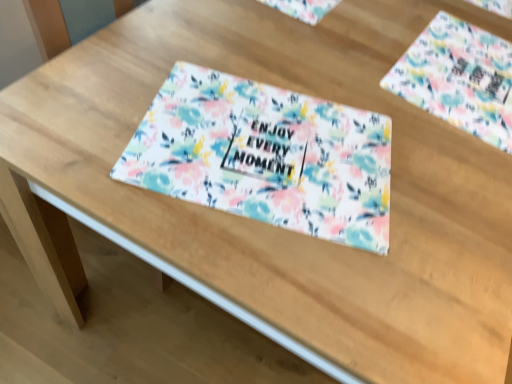
This screenshot has width=512, height=384. Find the location of `floral fabric placemat at center`. floral fabric placemat at center is located at coordinates (265, 156).

Measure the distance between point [251,161] and camera.

The distance of point [251,161] from camera is 28.74 inches.

What do you see at coordinates (265, 156) in the screenshot?
I see `floral fabric placemat at center` at bounding box center [265, 156].

Find the location of a particular element. floral fabric placemat at upper right is located at coordinates (459, 78).

This screenshot has width=512, height=384. What do you see at coordinates (459, 78) in the screenshot?
I see `floral fabric placemat at upper right` at bounding box center [459, 78].

You are a GUI agent. You are given a task and a screenshot of the screen. Output one action in this format:
    pyautogui.click(x=<x>, y=<y>)
    Task: Click on the floral fabric placemat at center
    
    Given the screenshot: What is the action you would take?
    pyautogui.click(x=265, y=156)

Does floral fabric placemat at center appear on the right side of floral fabric placemat at upper right?

In fact, floral fabric placemat at center is to the left of floral fabric placemat at upper right.

Is the depth of floral fabric placemat at center less than that of floral fabric placemat at upper right?

Yes, the depth of floral fabric placemat at center is less than that of floral fabric placemat at upper right.

Does point (359, 230) come farther from viewer compared to point (446, 25)?

That is False.

From the image's perspective, which is below, floral fabric placemat at center or floral fabric placemat at upper right?

From the image's view, floral fabric placemat at center is below.

From a real-world perspective, is floral fabric placemat at center located beneath floral fabric placemat at upper right?

No.

In terms of width, does floral fabric placemat at center look wider or thinner when compared to floral fabric placemat at upper right?

Clearly, floral fabric placemat at center has less width compared to floral fabric placemat at upper right.

Between floral fabric placemat at center and floral fabric placemat at upper right, which one has more height?

Standing taller between the two is floral fabric placemat at upper right.

Who is smaller, floral fabric placemat at center or floral fabric placemat at upper right?

With smaller size is floral fabric placemat at center.

Is floral fabric placemat at center positioned beyond the bounds of floral fabric placemat at upper right?

Yes, floral fabric placemat at center is not within floral fabric placemat at upper right.

Can you see floral fabric placemat at center touching floral fabric placemat at upper right?

No, floral fabric placemat at center is not beside floral fabric placemat at upper right.

Is floral fabric placemat at center aimed at floral fabric placemat at upper right?

No, floral fabric placemat at center is not aimed at floral fabric placemat at upper right.

How different are the orientations of floral fabric placemat at center and floral fabric placemat at upper right in degrees?

floral fabric placemat at center and floral fabric placemat at upper right are facing 68.6 degrees away from each other.

How distant is floral fabric placemat at center from floral fabric placemat at upper right?

floral fabric placemat at center and floral fabric placemat at upper right are 13.82 inches apart.

The image size is (512, 384). What are the coordinates of `tablecloth located below the floral fabric placemat at upper right (from the image's perspective)` in the screenshot? It's located at (265, 156).

Considering the positions of objects floral fabric placemat at upper right and floral fabric placemat at center in the image provided, who is more to the right, floral fabric placemat at upper right or floral fabric placemat at center?

From the viewer's perspective, floral fabric placemat at upper right appears more on the right side.

Is floral fabric placemat at upper right positioned behind floral fabric placemat at center?

Yes, floral fabric placemat at upper right is further from the camera.

Is point (485, 59) farther from viewer compared to point (182, 169)?

Yes, it is behind point (182, 169).

From the image's perspective, is floral fabric placemat at upper right above or below floral fabric placemat at center?

floral fabric placemat at upper right is above floral fabric placemat at center.

From a real-world perspective, which object rests below the other?

floral fabric placemat at upper right is physically lower.

Considering the relative sizes of floral fabric placemat at upper right and floral fabric placemat at center in the image provided, is floral fabric placemat at upper right thinner than floral fabric placemat at center?

No.

Who is taller, floral fabric placemat at upper right or floral fabric placemat at center?

floral fabric placemat at upper right is taller.

Considering the relative sizes of floral fabric placemat at upper right and floral fabric placemat at center in the image provided, is floral fabric placemat at upper right bigger than floral fabric placemat at center?

Yes, floral fabric placemat at upper right is bigger than floral fabric placemat at center.

Would you say floral fabric placemat at upper right is outside floral fabric placemat at center?

floral fabric placemat at upper right lies outside floral fabric placemat at center's area.

Is floral fabric placemat at upper right next to floral fabric placemat at center and touching it?

There is a gap between floral fabric placemat at upper right and floral fabric placemat at center.

Is floral fabric placemat at upper right positioned with its back to floral fabric placemat at center?

Yes, floral fabric placemat at upper right is facing away from floral fabric placemat at center.

Can you tell me how much floral fabric placemat at upper right and floral fabric placemat at center differ in facing direction?

The angular difference between floral fabric placemat at upper right and floral fabric placemat at center is 68.6 degrees.

Where is `flyer behind the floral fabric placemat at center`? The image size is (512, 384). flyer behind the floral fabric placemat at center is located at coordinates (459, 78).

At what (x,y) coordinates should I click in order to perform the action: click on tablecloth that is above the floral fabric placemat at upper right (from a real-world perspective). Please return your answer as a coordinate pair (x, y). Looking at the image, I should click on (265, 156).

This screenshot has height=384, width=512. What are the coordinates of `flyer behind the floral fabric placemat at center` in the screenshot? It's located at (459, 78).